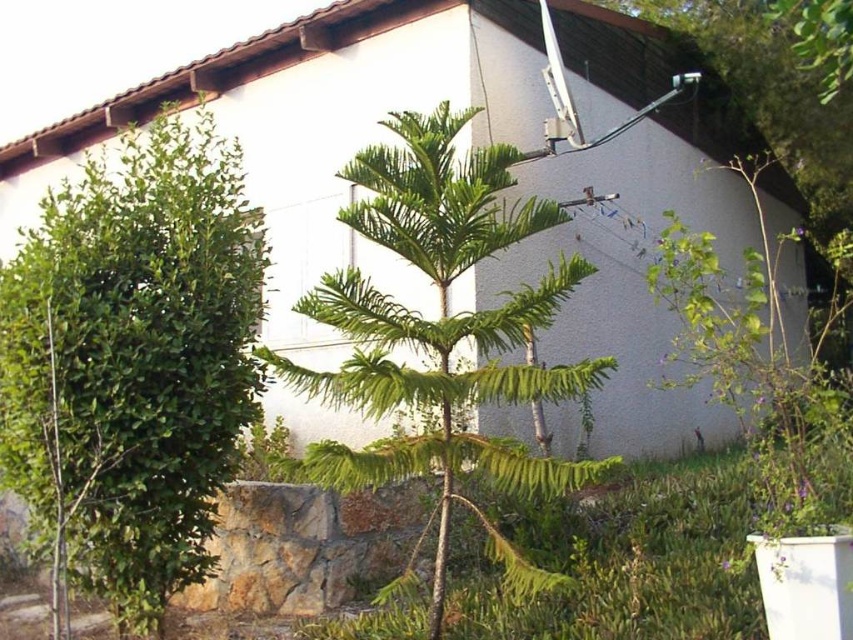
Between point (216, 160) and point (508, 244), which one is positioned behind?

Positioned behind is point (216, 160).

Does point (155, 490) come behind point (303, 381)?

Yes, point (155, 490) is farther from viewer.

The height and width of the screenshot is (640, 853). Describe the element at coordinates (132, 362) in the screenshot. I see `green leafy shrub at left` at that location.

Where is `green leafy shrub at left`? This screenshot has width=853, height=640. green leafy shrub at left is located at coordinates (132, 362).